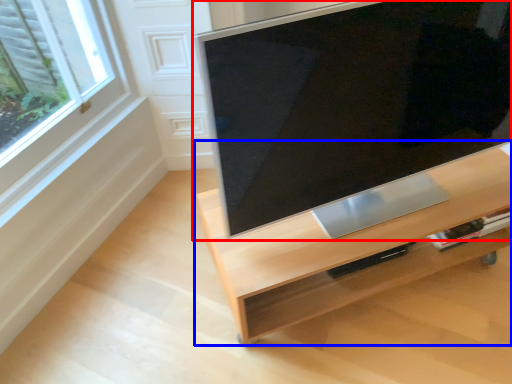
Question: Which object appears farthest to the camera in this image, television (highlighted by a red box) or furniture (highlighted by a blue box)?

Choices:
 (A) television
 (B) furniture

Answer: (B)